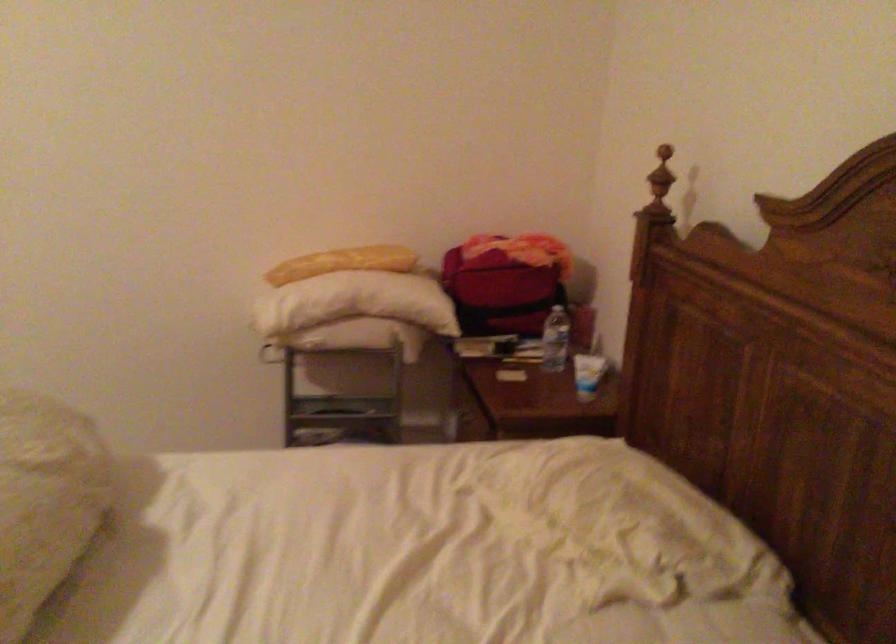
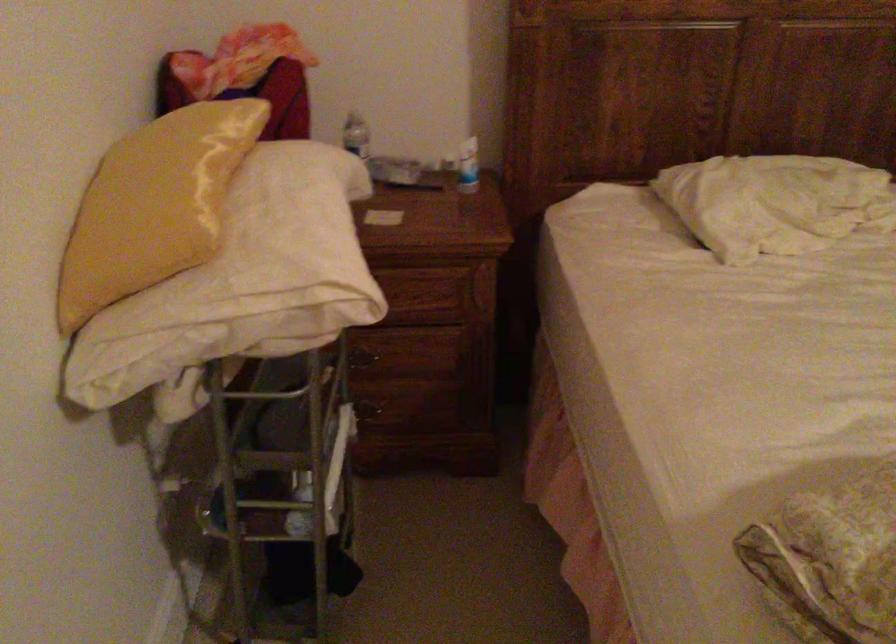
Where in the second image is the point corresponding to pixel 293 258 from the first image?

(153, 205)